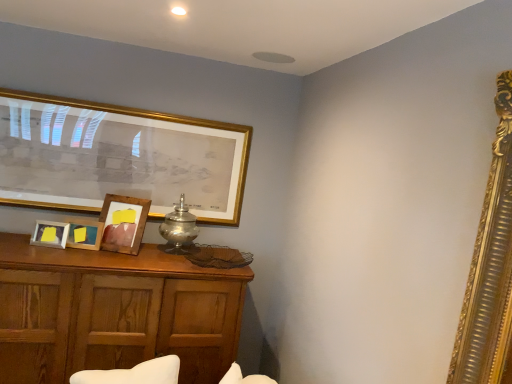
Locate an element on the screen. The height and width of the screenshot is (384, 512). free space in front of silver metallic table lamp at center is located at coordinates (164, 253).